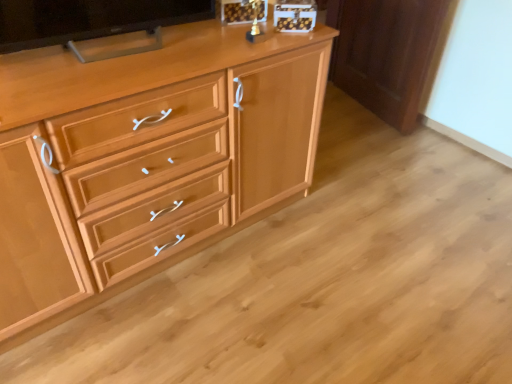
You are a GUI agent. You are given a task and a screenshot of the screen. Output one action in this format:
    pyautogui.click(x=<x>, y=<y>)
    Task: Click on the vacant area that is in front of matte black tv at upper left
    
    Given the screenshot: What is the action you would take?
    point(88,78)